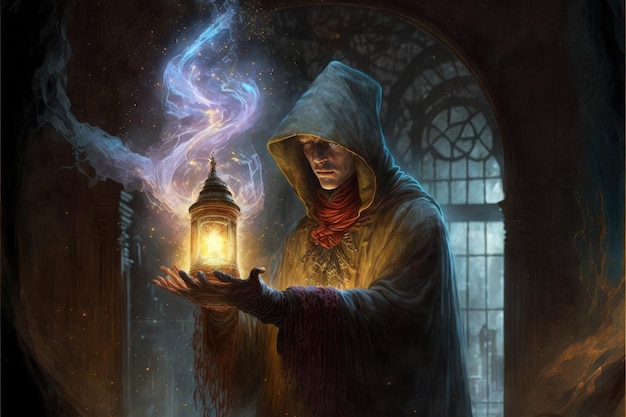
Locate an element on the screen. Image resolution: width=626 pixels, height=417 pixels. lantern is located at coordinates (217, 200).